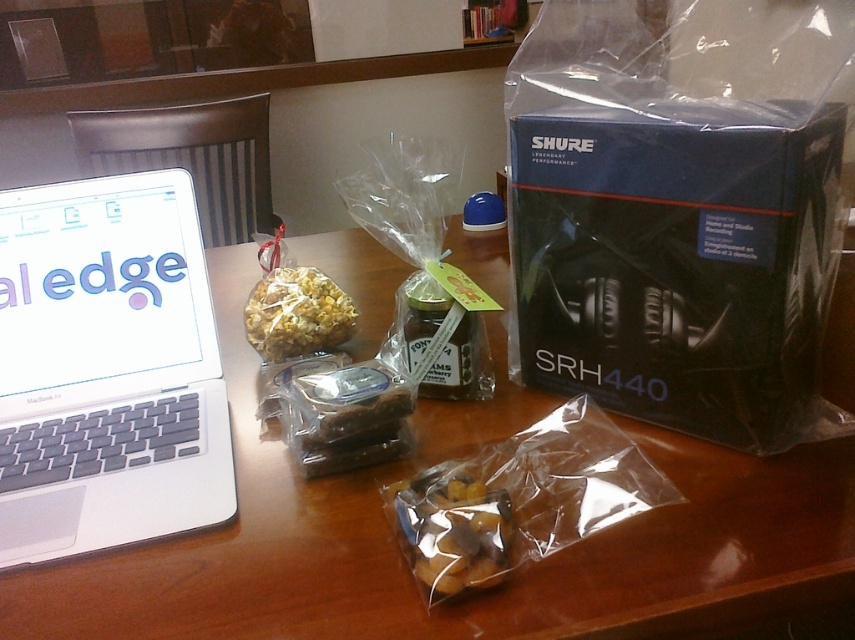
Question: Based on their relative distances, which object is nearer to the blue matte box at right?

Choices:
 (A) translucent plastic bag of snacks at center
 (B) wooden table at center

Answer: (B)

Question: Can you confirm if translucent plastic bag of snacks at center is bigger than shiny popcorn at center?

Choices:
 (A) no
 (B) yes

Answer: (A)

Question: Does blue matte box at right lie behind silver metallic laptop at left?

Choices:
 (A) no
 (B) yes

Answer: (A)

Question: Which point is farther from the camera taking this photo?

Choices:
 (A) (308, 291)
 (B) (342, 520)
 (C) (428, 496)

Answer: (A)

Question: Is silver metallic laptop at left to the right of translucent plastic bag of snacks at center from the viewer's perspective?

Choices:
 (A) no
 (B) yes

Answer: (A)

Question: Which object is the farthest from the blue matte box at right?

Choices:
 (A) shiny popcorn at center
 (B) wooden table at center

Answer: (A)